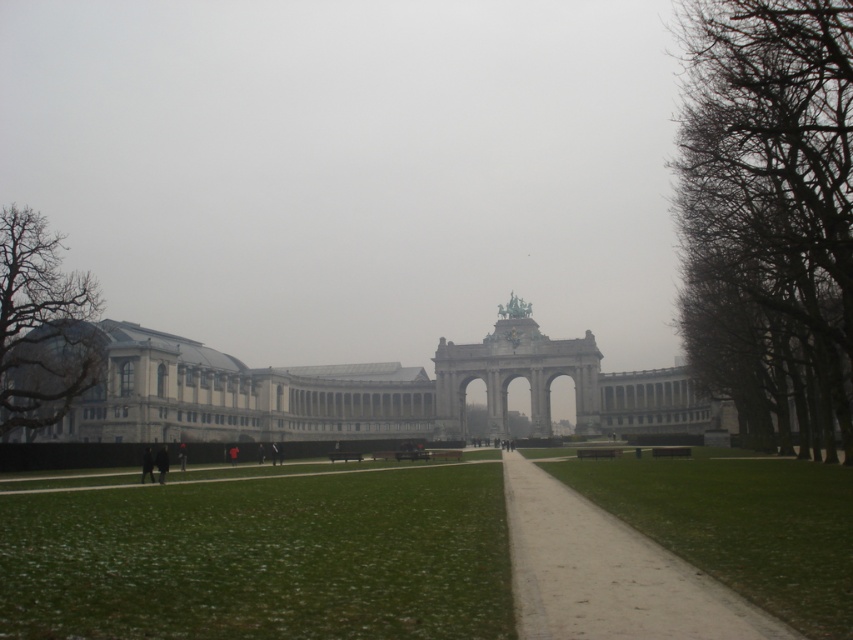
Does green grass at lower center have a larger size compared to dark gray fabric jacket at lower left?

Indeed, green grass at lower center has a larger size compared to dark gray fabric jacket at lower left.

This screenshot has height=640, width=853. I want to click on green grass at lower center, so click(262, 557).

Between point (445, 480) and point (178, 460), which one is positioned behind?

Positioned behind is point (178, 460).

The image size is (853, 640). Find the location of `green grass at lower center`. green grass at lower center is located at coordinates (262, 557).

Is green grass at lower center smaller than smooth concrete path at center?

Incorrect, green grass at lower center is not smaller in size than smooth concrete path at center.

Find the location of `green grass at lower center`. green grass at lower center is located at coordinates (262, 557).

Locate an element on the screen. This screenshot has width=853, height=640. green grass at lower center is located at coordinates (262, 557).

Between smooth concrete path at center and dark gray coat at lower left, which one is positioned lower?

smooth concrete path at center is lower down.

Between smooth concrete path at center and dark gray coat at lower left, which one appears on the right side from the viewer's perspective?

smooth concrete path at center is more to the right.

Is point (672, 624) farther from camera compared to point (161, 461)?

No, it is in front of (161, 461).

I want to click on smooth concrete path at center, so click(x=608, y=573).